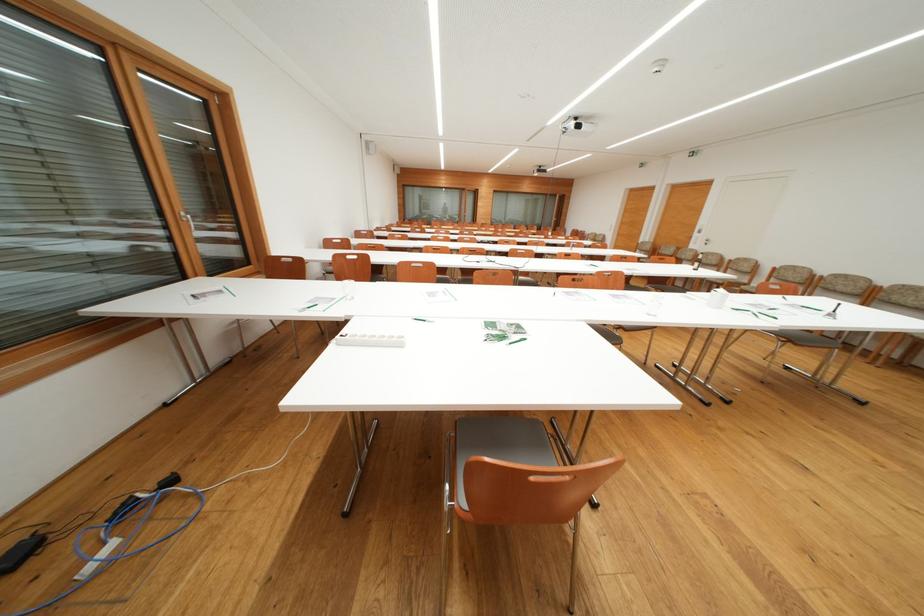
Where is `silver window handle`? The image size is (924, 616). silver window handle is located at coordinates (188, 221).